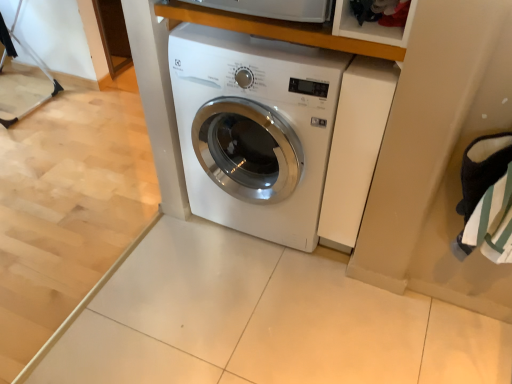
Image resolution: width=512 pixels, height=384 pixels. What do you see at coordinates (254, 129) in the screenshot?
I see `white glossy washing machine at center` at bounding box center [254, 129].

The height and width of the screenshot is (384, 512). I want to click on white glossy washing machine at center, so click(x=254, y=129).

Identify the location of wooden at upper center. (277, 30).

What do you see at coordinates (277, 30) in the screenshot?
I see `wooden at upper center` at bounding box center [277, 30].

In order to click on white glossy washing machine at center in this screenshot , I will do `click(254, 129)`.

Considering the positions of objects white glossy washing machine at center and wooden at upper center in the image provided, who is more to the right, white glossy washing machine at center or wooden at upper center?

wooden at upper center is more to the right.

Considering the positions of objects white glossy washing machine at center and wooden at upper center in the image provided, who is in front, white glossy washing machine at center or wooden at upper center?

wooden at upper center is more forward.

Is point (339, 86) positioned after point (231, 14)?

That is True.

From the image's perspective, which one is positioned lower, white glossy washing machine at center or wooden at upper center?

white glossy washing machine at center, from the image's perspective.

From a real-world perspective, who is located lower, white glossy washing machine at center or wooden at upper center?

In real-world perspective, white glossy washing machine at center is lower.

Considering the sizes of white glossy washing machine at center and wooden at upper center in the image, is white glossy washing machine at center wider or thinner than wooden at upper center?

Considering their sizes, white glossy washing machine at center looks broader than wooden at upper center.

Is white glossy washing machine at center shorter than wooden at upper center?

Incorrect, the height of white glossy washing machine at center does not fall short of that of wooden at upper center.

Does white glossy washing machine at center have a smaller size compared to wooden at upper center?

No.

Is wooden at upper center surrounded by white glossy washing machine at center?

No, wooden at upper center is not inside white glossy washing machine at center.

Is white glossy washing machine at center next to wooden at upper center?

No, white glossy washing machine at center is not with wooden at upper center.

Is white glossy washing machine at center positioned with its back to wooden at upper center?

No, white glossy washing machine at center's orientation is not away from wooden at upper center.

Locate an element on the screen. The image size is (512, 384). shelf located on the right of white glossy washing machine at center is located at coordinates (277, 30).

Can you confirm if wooden at upper center is positioned to the right of white glossy washing machine at center?

Correct, you'll find wooden at upper center to the right of white glossy washing machine at center.

Is the position of wooden at upper center less distant than that of white glossy washing machine at center?

Yes.

Which is nearer, (175, 0) or (297, 195)?

Positioned in front is point (175, 0).

From the image's perspective, is wooden at upper center positioned above or below white glossy washing machine at center?

wooden at upper center is above white glossy washing machine at center.

From a real-world perspective, between wooden at upper center and white glossy washing machine at center, who is vertically lower?

white glossy washing machine at center is physically lower.

Looking at their sizes, would you say wooden at upper center is wider or thinner than white glossy washing machine at center?

Clearly, wooden at upper center has less width compared to white glossy washing machine at center.

From the picture: Considering the sizes of wooden at upper center and white glossy washing machine at center in the image, is wooden at upper center taller or shorter than white glossy washing machine at center?

Clearly, wooden at upper center is shorter compared to white glossy washing machine at center.

Can you confirm if wooden at upper center is bigger than white glossy washing machine at center?

No, wooden at upper center is not bigger than white glossy washing machine at center.

Looking at this image, is wooden at upper center not within white glossy washing machine at center?

That's correct, wooden at upper center is outside of white glossy washing machine at center.

Would you say wooden at upper center is a long distance from white glossy washing machine at center?

Actually, wooden at upper center and white glossy washing machine at center are a little close together.

Could you tell me if wooden at upper center is facing white glossy washing machine at center?

No, wooden at upper center is not turned towards white glossy washing machine at center.

How different are the orientations of wooden at upper center and white glossy washing machine at center in degrees?

wooden at upper center and white glossy washing machine at center are facing 0.000249 degrees away from each other.

Where is `washing machine to the left of wooden at upper center`? The width and height of the screenshot is (512, 384). washing machine to the left of wooden at upper center is located at coordinates (254, 129).

At what (x,y) coordinates should I click in order to perform the action: click on washing machine that appears behind the wooden at upper center. Please return your answer as a coordinate pair (x, y). Image resolution: width=512 pixels, height=384 pixels. Looking at the image, I should click on (254, 129).

Where is `shelf on the right of white glossy washing machine at center`? The image size is (512, 384). shelf on the right of white glossy washing machine at center is located at coordinates (277, 30).